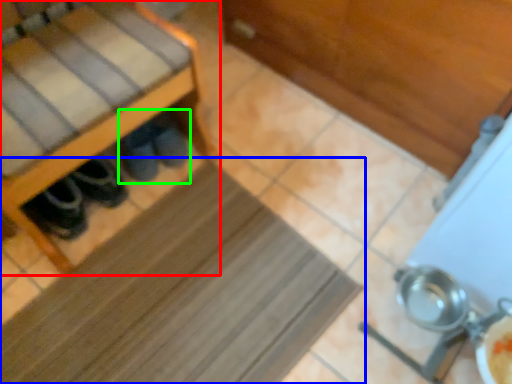
Question: Which object is positioned closest to furniture (highlighted by a red box)? Select from mat (highlighted by a blue box) and footwear (highlighted by a green box).

Choices:
 (A) mat
 (B) footwear

Answer: (B)